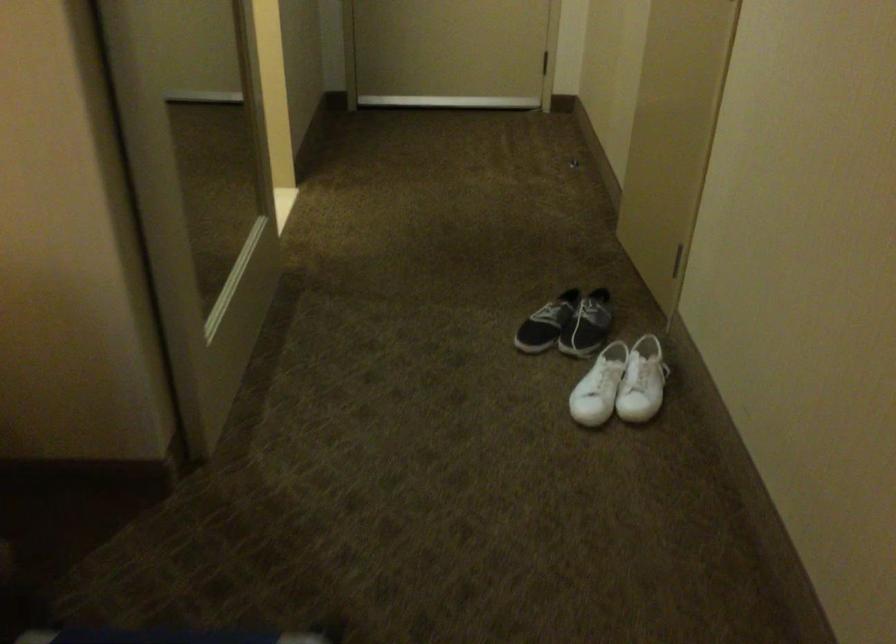
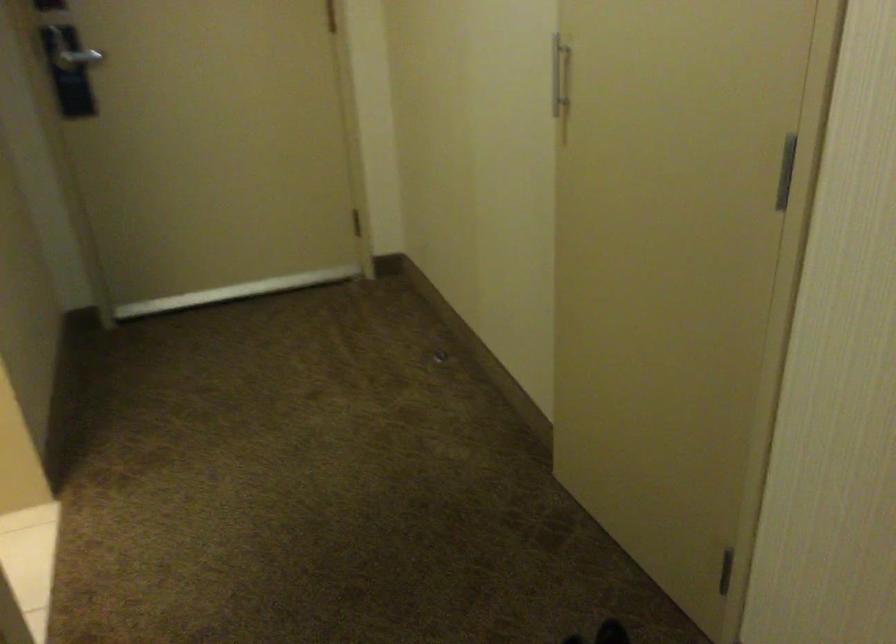
Question: What movement of the cameraman would produce the second image?

Choices:
 (A) Left
 (B) Right
 (C) Forward
 (D) Backward

Answer: (C)